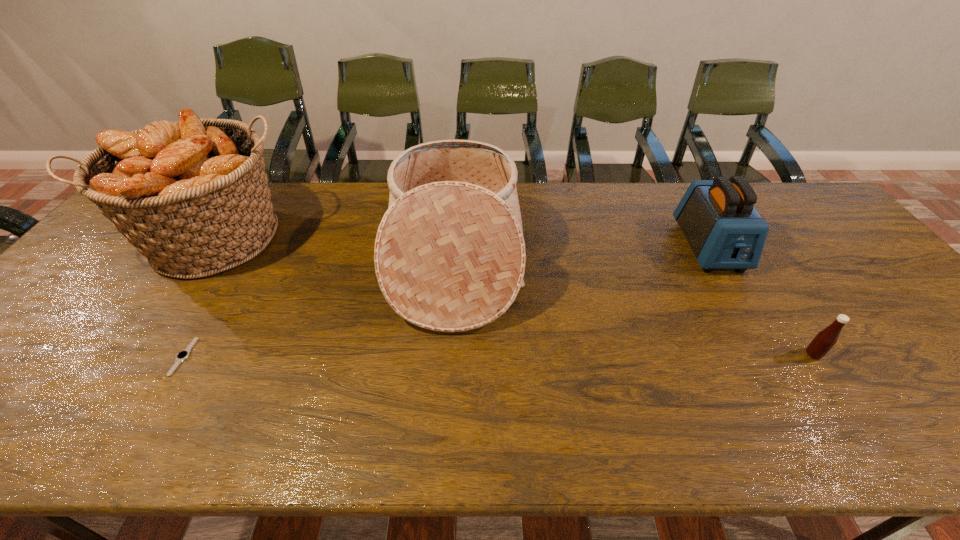
Locate an element on the screen. the left basket is located at coordinates (192, 196).

Where is `the shorter basket`? The height and width of the screenshot is (540, 960). the shorter basket is located at coordinates (449, 255).

This screenshot has width=960, height=540. In order to click on the right basket in this screenshot , I will do `click(449, 255)`.

At what (x,y) coordinates should I click in order to perform the action: click on the second object from right to left. Please return your answer as a coordinate pair (x, y). The height and width of the screenshot is (540, 960). Looking at the image, I should click on (724, 230).

I want to click on the third tallest object, so click(x=724, y=230).

Locate an element on the screen. Tabasco sauce is located at coordinates (822, 343).

Where is `the rightmost object`? the rightmost object is located at coordinates (822, 343).

Where is `the shortest object`? the shortest object is located at coordinates (182, 355).

Identify the location of free space located 0.060m on the front of the left basket. (174, 308).

This screenshot has width=960, height=540. Identify the location of vacant space situated with the lid open on the shorter basket. (551, 261).